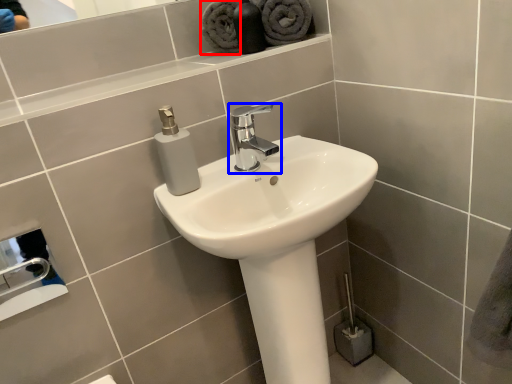
Question: Which object is closer to the camera taking this photo, bath towel (highlighted by a red box) or tap (highlighted by a blue box)?

Choices:
 (A) bath towel
 (B) tap

Answer: (B)